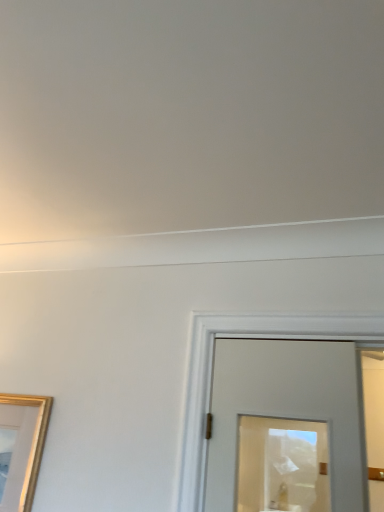
The width and height of the screenshot is (384, 512). In order to click on gold metallic picture frame at lower left in this screenshot , I will do `click(21, 448)`.

This screenshot has width=384, height=512. What do you see at coordinates (21, 448) in the screenshot?
I see `gold metallic picture frame at lower left` at bounding box center [21, 448].

The height and width of the screenshot is (512, 384). Identify the location of gold metallic picture frame at lower left. (21, 448).